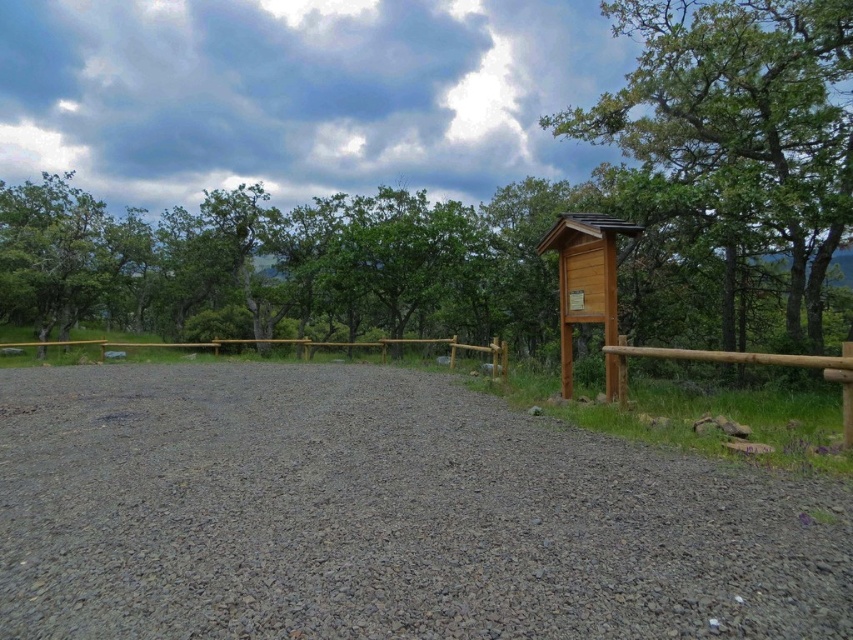
Question: Estimate the real-world distances between objects in this image. Which object is farther from the green wood sign at right?

Choices:
 (A) brown wooden fence at center
 (B) gray gravel at center
 (C) wooden sign at upper right

Answer: (B)

Question: Does gray gravel at center have a smaller size compared to wooden sign at upper right?

Choices:
 (A) no
 (B) yes

Answer: (A)

Question: Is gray gravel at center bigger than brown wooden fence at center?

Choices:
 (A) yes
 (B) no

Answer: (B)

Question: Is wooden sign at upper right below brown wooden fence at center?

Choices:
 (A) yes
 (B) no

Answer: (B)

Question: Estimate the real-world distances between objects in this image. Which object is farther from the green wood sign at right?

Choices:
 (A) gray gravel at center
 (B) wooden sign at upper right
 (C) brown wooden fence at center

Answer: (A)

Question: Which object is positioned closest to the green wood sign at right?

Choices:
 (A) wooden sign at upper right
 (B) gray gravel at center
 (C) brown wooden fence at center

Answer: (A)